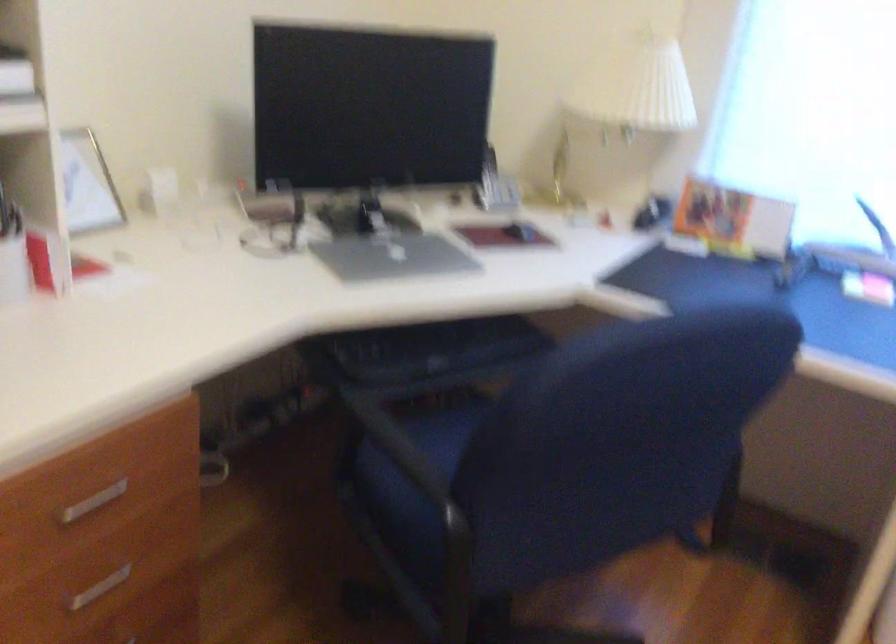
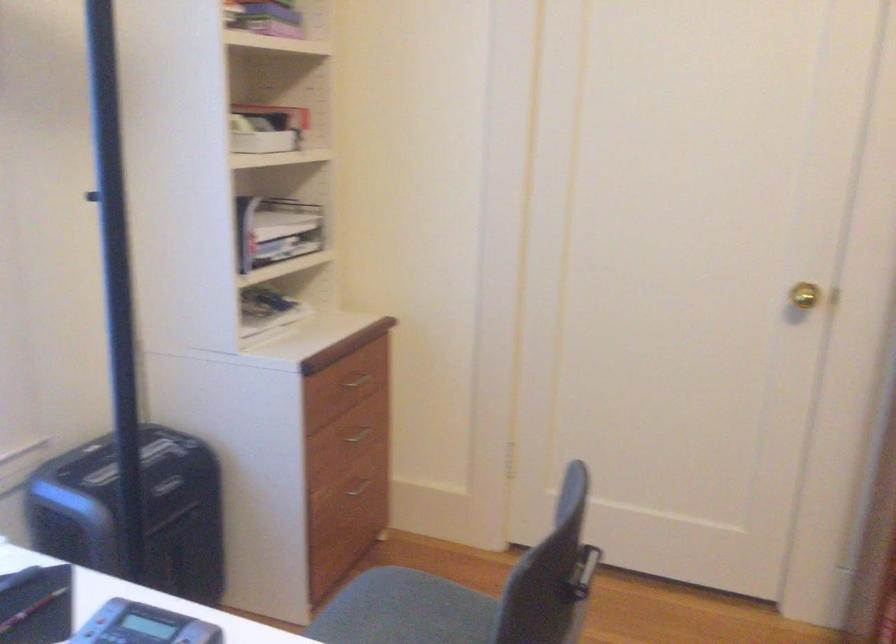
Based on the continuous images, in which direction is the camera rotating?

The camera's rotation is toward right-down.